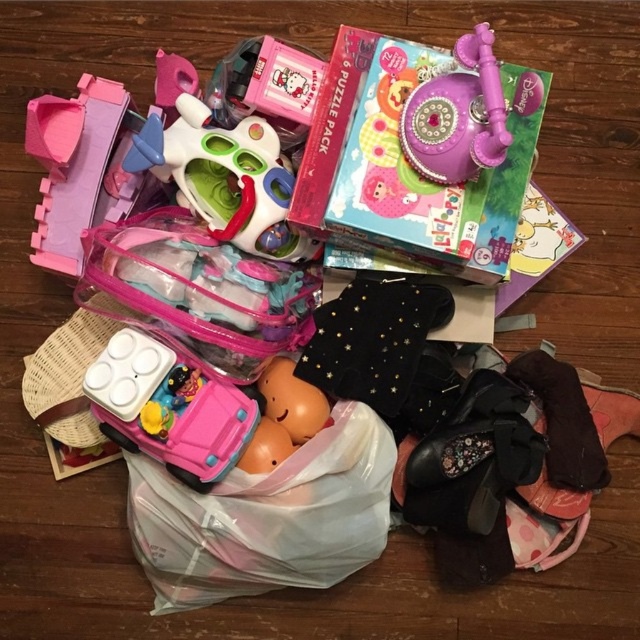
Question: Which of these objects is positioned closest to the smooth orange plush at center?

Choices:
 (A) translucent plastic toy car at center
 (B) translucent plastic bag at center

Answer: (A)

Question: From the image, what is the correct spatial relationship of translucent plastic bag at center in relation to smooth orange plush at center?

Choices:
 (A) above
 (B) below

Answer: (B)

Question: Can you confirm if translucent plastic toy car at center is positioned below smooth orange plush at center?

Choices:
 (A) yes
 (B) no

Answer: (B)

Question: Among these points, which one is nearest to the camera?

Choices:
 (A) click(x=161, y=432)
 (B) click(x=358, y=413)
 (C) click(x=209, y=157)

Answer: (A)

Question: Among these objects, which one is nearest to the camera?

Choices:
 (A) translucent plastic toy car at center
 (B) translucent plastic toy at center
 (C) translucent plastic bag at center

Answer: (A)

Question: Is translucent plastic toy car at center behind smooth orange plush at center?

Choices:
 (A) yes
 (B) no

Answer: (B)